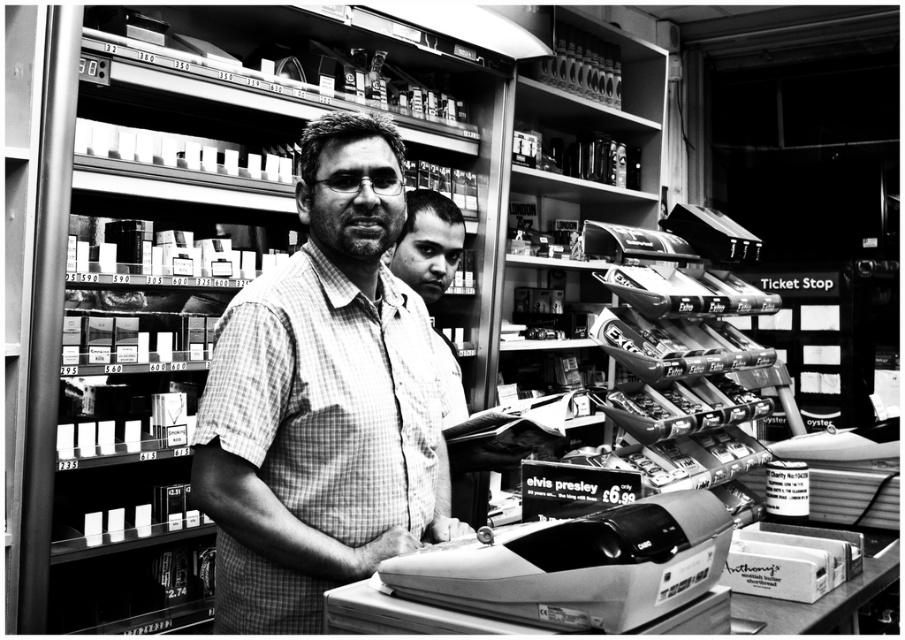
You are a customer entering the store and see the checkered fabric shirt at center and the metallic gray cash register at lower center. Which object is higher in height?

The checkered fabric shirt at center is taller than the metallic gray cash register at lower center.